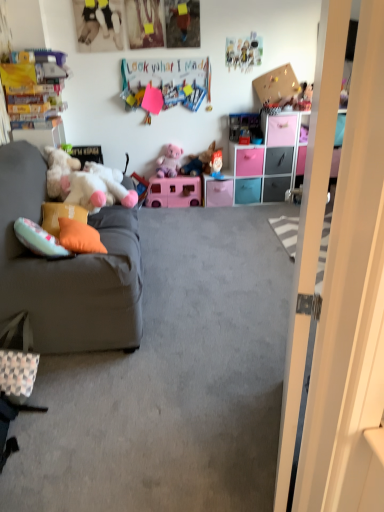
The width and height of the screenshot is (384, 512). I want to click on vacant space situated above plush pink teddy bear at upper right, the 2th toy viewed from the top (from a real-world perspective), so click(x=306, y=82).